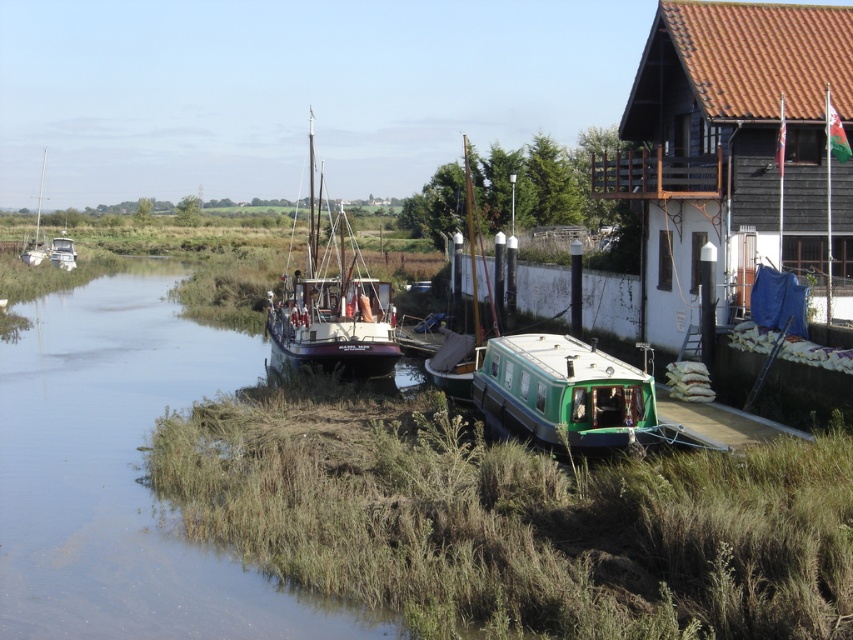
You are an architect designing a new riverside development and need to assess the available space. Given the brown wooden hut at upper right and the white wooden sailboat at left, which object takes up more area in the scene?

The white wooden sailboat at left occupies more area than the brown wooden hut at upper right because the brown wooden hut at upper right occupies less space than white wooden sailboat at left.

You are standing at the point with coordinates point (822, 179) and want to walk to the point with coordinates point (38, 244). According to the scene, which direction should you face to move towards your destination?

Since point (822, 179) is in front of point (38, 244), you should face backward to move towards point (38, 244).

You are standing at the riverside and want to know how far the point marked at coordinates (822, 212) is from your current position. Can you determine the distance?

The point marked at coordinates (822, 212) is 20.94 meters away from your current position.